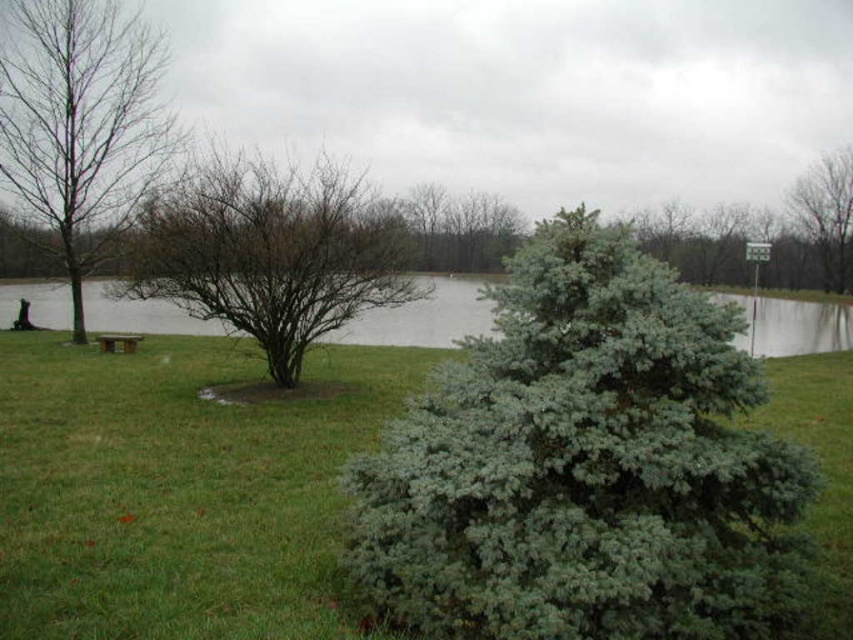
Question: Is green needle-like tree at center positioned before clear water at center?

Choices:
 (A) yes
 (B) no

Answer: (A)

Question: Which point is closer to the camera?

Choices:
 (A) green needle-like tree at center
 (B) green textured bush at center
 (C) bare wood tree at left

Answer: (A)

Question: Which object is farther from the camera taking this photo?

Choices:
 (A) clear water at center
 (B) brown leafless tree at upper right
 (C) wooden park bench at left
 (D) bare branches bush at center

Answer: (B)

Question: From the image, what is the correct spatial relationship of green needle-like tree at center in relation to wooden park bench at left?

Choices:
 (A) left
 (B) right

Answer: (B)

Question: Which point is closer to the camera?

Choices:
 (A) (799, 182)
 (B) (268, 248)
 (C) (123, 348)
 (D) (628, 260)

Answer: (D)

Question: Is green needle-like tree at center thinner than bare branches bush at center?

Choices:
 (A) no
 (B) yes

Answer: (B)